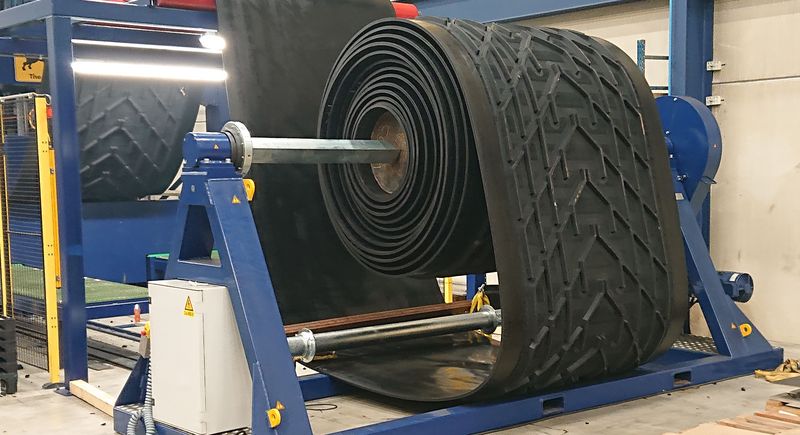
Locate an element on the screen. power cable is located at coordinates (148, 423).